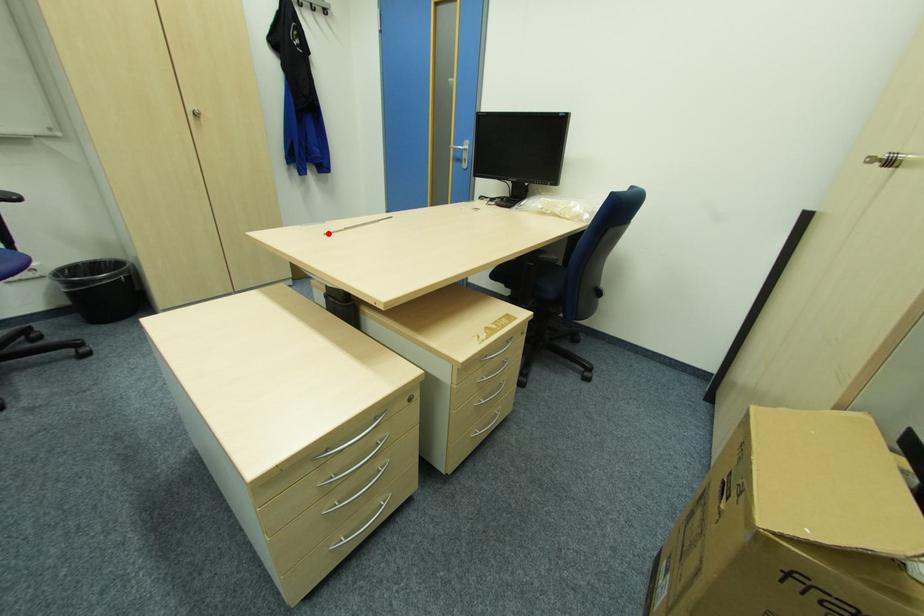
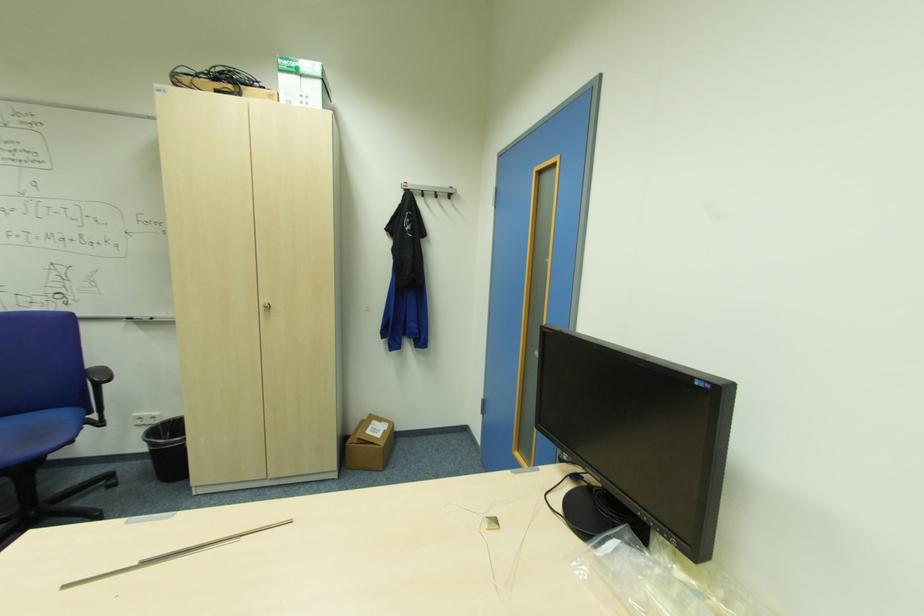
Question: I am providing you with two images of the same scene from different viewpoints. Image1 has a red point marked. In image2, the corresponding 3D location appears at what relative position? Reply with the corresponding letter.

Choices:
 (A) Closer
 (B) Farther

Answer: (A)